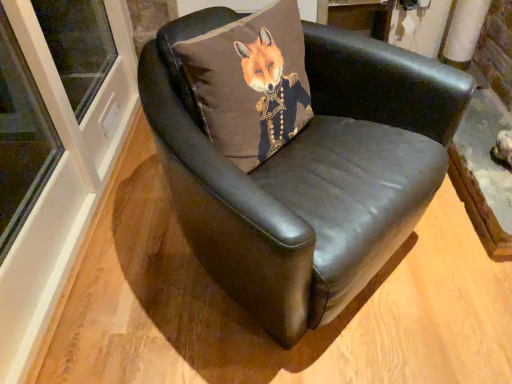
Question: Does black leather chair at center have a larger size compared to brown fabric pillow at center?

Choices:
 (A) yes
 (B) no

Answer: (A)

Question: Can you confirm if black leather chair at center is wider than brown fabric pillow at center?

Choices:
 (A) yes
 (B) no

Answer: (A)

Question: Can brown fabric pillow at center be found inside black leather chair at center?

Choices:
 (A) yes
 (B) no

Answer: (A)

Question: Is black leather chair at center further to camera compared to brown fabric pillow at center?

Choices:
 (A) yes
 (B) no

Answer: (B)

Question: Is black leather chair at center to the right of brown fabric pillow at center from the viewer's perspective?

Choices:
 (A) no
 (B) yes

Answer: (B)

Question: Is the position of black leather chair at center less distant than that of brown fabric pillow at center?

Choices:
 (A) no
 (B) yes

Answer: (B)

Question: Is brown fabric pillow at center positioned in front of black leather chair at center?

Choices:
 (A) yes
 (B) no

Answer: (B)

Question: Does brown fabric pillow at center have a lesser width compared to black leather chair at center?

Choices:
 (A) no
 (B) yes

Answer: (B)

Question: From the image's perspective, would you say brown fabric pillow at center is shown under black leather chair at center?

Choices:
 (A) no
 (B) yes

Answer: (A)

Question: Does brown fabric pillow at center have a greater width compared to black leather chair at center?

Choices:
 (A) yes
 (B) no

Answer: (B)

Question: From the image's perspective, is brown fabric pillow at center above black leather chair at center?

Choices:
 (A) yes
 (B) no

Answer: (A)

Question: Does brown fabric pillow at center have a smaller size compared to black leather chair at center?

Choices:
 (A) no
 (B) yes

Answer: (B)

Question: From the image's perspective, is brown fabric pillow at center above or below black leather chair at center?

Choices:
 (A) above
 (B) below

Answer: (A)